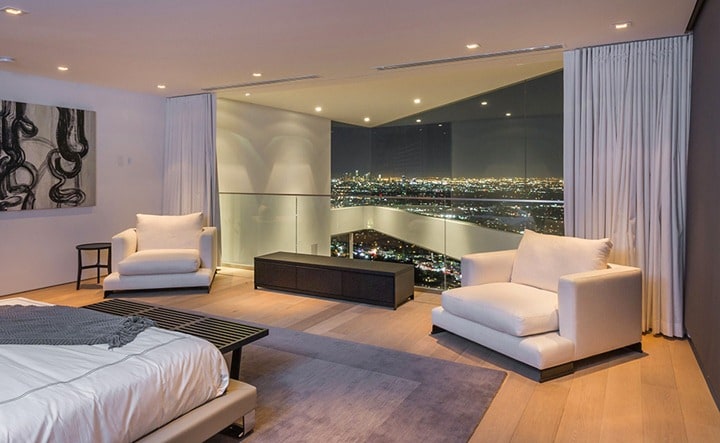
Where is `sofa`? This screenshot has width=720, height=443. sofa is located at coordinates (500, 313).